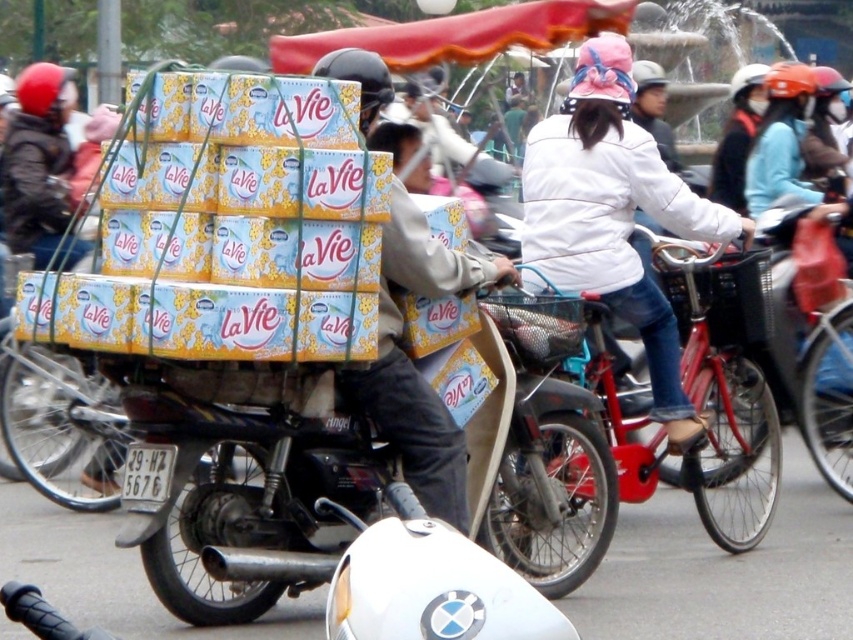
Question: Can you confirm if metallic silver motorcycle at center is positioned above red matte bicycle at center?

Choices:
 (A) yes
 (B) no

Answer: (B)

Question: Is white matte jacket at center to the right of red matte bicycle at center from the viewer's perspective?

Choices:
 (A) no
 (B) yes

Answer: (A)

Question: Among these points, which one is farthest from the camera?

Choices:
 (A) (735, 364)
 (B) (654, 164)

Answer: (A)

Question: Does metallic silver motorcycle at center appear on the left side of red matte bicycle at center?

Choices:
 (A) yes
 (B) no

Answer: (A)

Question: Estimate the real-world distances between objects in this image. Which object is farther from the metallic silver motorcycle at center?

Choices:
 (A) white matte jacket at center
 (B) red matte bicycle at center

Answer: (B)

Question: Estimate the real-world distances between objects in this image. Which object is closer to the white matte jacket at center?

Choices:
 (A) red matte bicycle at center
 (B) metallic silver motorcycle at center

Answer: (A)